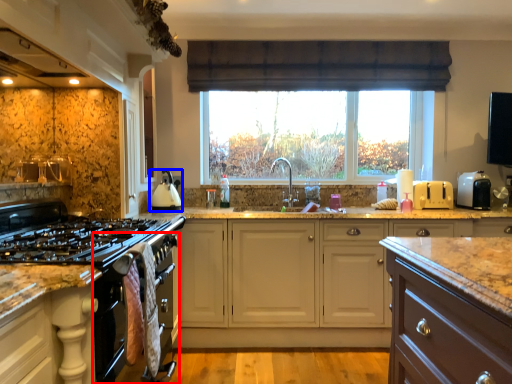
Question: Which object appears farthest to the camera in this image, oven (highlighted by a red box) or kitchen appliance (highlighted by a blue box)?

Choices:
 (A) oven
 (B) kitchen appliance

Answer: (B)